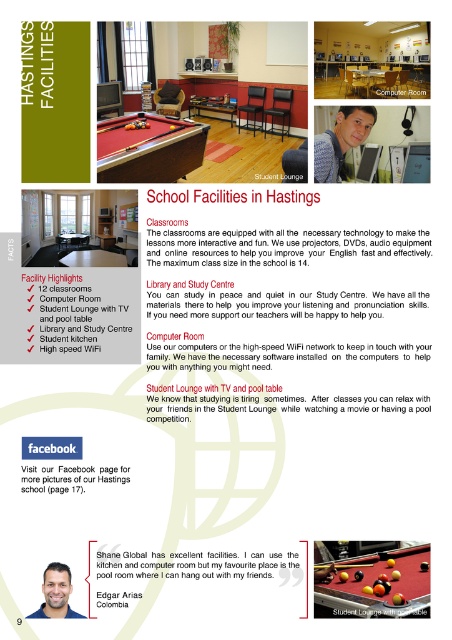
Is yellow felt pool table at center below red felt pool table at center?

Correct, yellow felt pool table at center is located below red felt pool table at center.

Does yellow felt pool table at center have a smaller size compared to red felt pool table at center?

Indeed, yellow felt pool table at center has a smaller size compared to red felt pool table at center.

The image size is (452, 640). What do you see at coordinates (375, 582) in the screenshot?
I see `yellow felt pool table at center` at bounding box center [375, 582].

The image size is (452, 640). I want to click on yellow felt pool table at center, so click(375, 582).